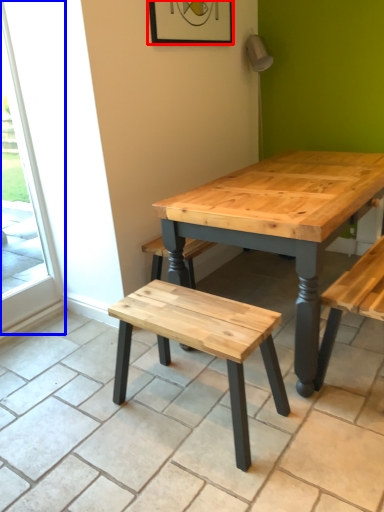
Question: Which of the following is the closest to the observer, picture frame (highlighted by a red box) or screen door (highlighted by a blue box)?

Choices:
 (A) picture frame
 (B) screen door

Answer: (B)